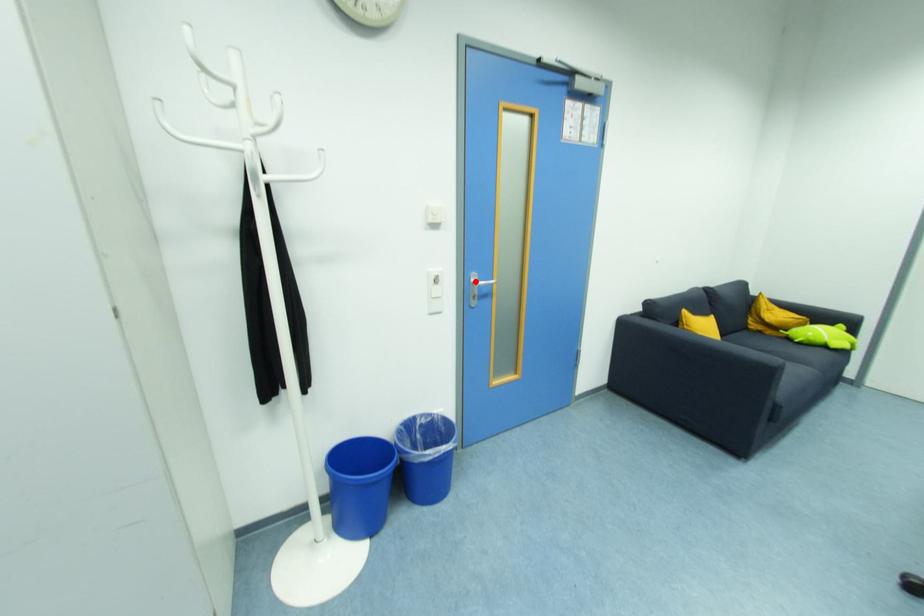
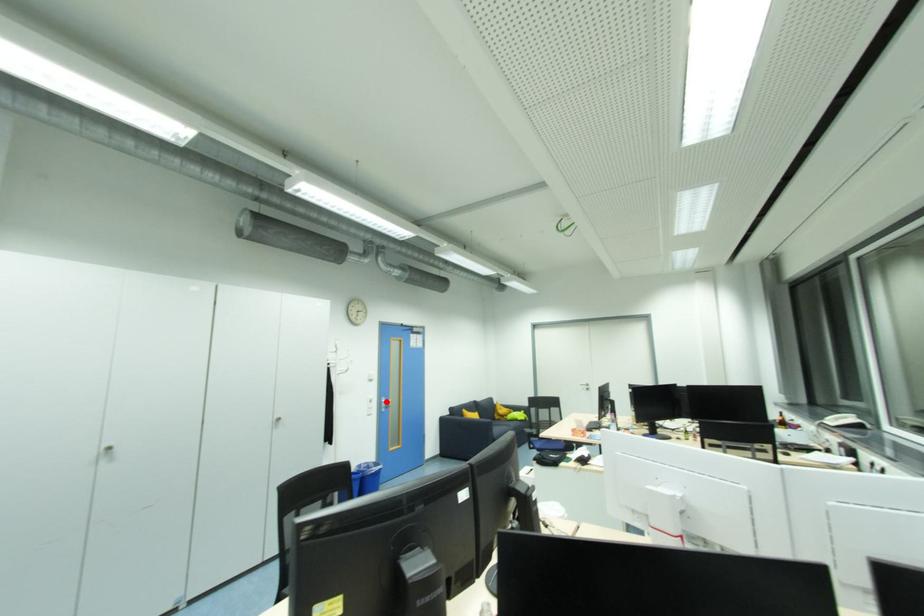
I am providing you with two images of the same scene from different viewpoints. A red point is marked on the first image and another point is marked on the second image. Is the red point in image1 aligned with the point shown in image2?

Yes